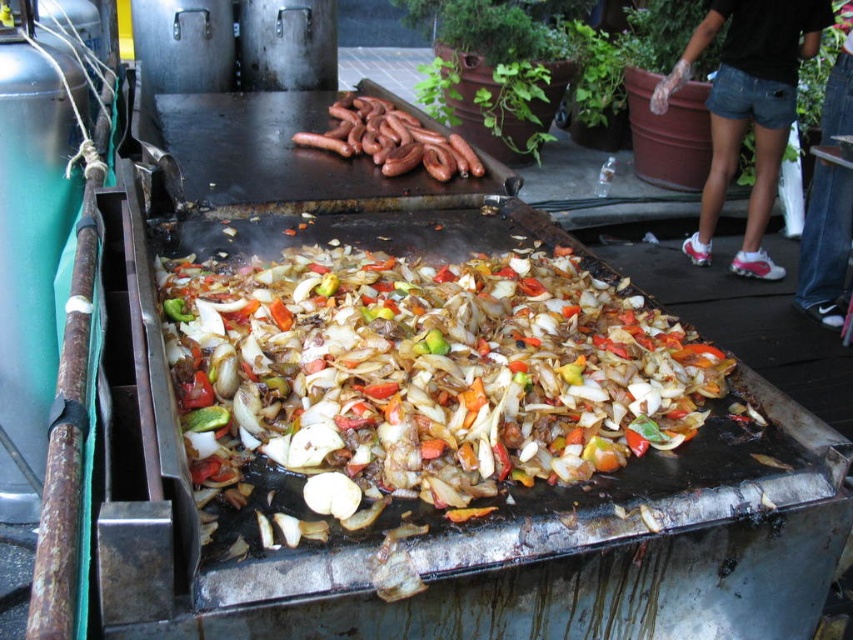
Which is behind, point (727, 358) or point (456, 161)?

The point (456, 161) is more distant.

The image size is (853, 640). What do you see at coordinates (422, 372) in the screenshot?
I see `slightly browned vegetables at center` at bounding box center [422, 372].

The image size is (853, 640). What are the coordinates of `slightly browned vegetables at center` in the screenshot? It's located at tap(422, 372).